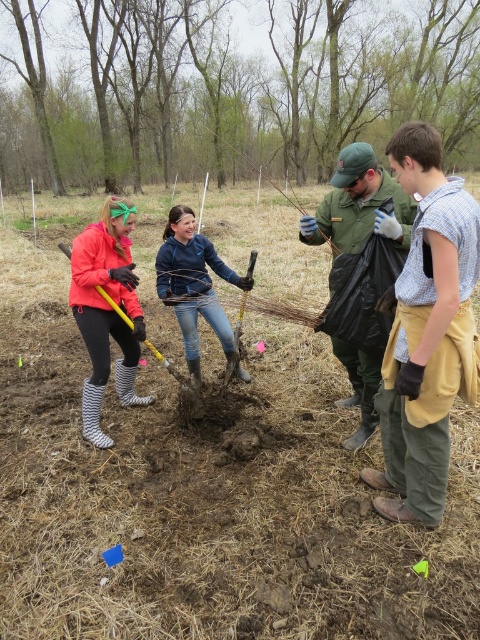
Who is more forward, (342,216) or (232,371)?

Positioned in front is point (342,216).

Does green matte jacket at center come in front of yellow metal shovel at center?

Yes, it is.

This screenshot has height=640, width=480. Identify the location of green matte jacket at center. (360, 205).

The image size is (480, 640). What are the coordinates of `blue denim jeans at center` in the screenshot? It's located at (193, 284).

This screenshot has height=640, width=480. I want to click on blue denim jeans at center, so click(x=193, y=284).

Identify the location of blue denim jeans at center. The image size is (480, 640). (193, 284).

What do you see at coordinates (231, 90) in the screenshot? I see `smooth bark tree at upper center` at bounding box center [231, 90].

From the picture: Can you confirm if smooth bark tree at upper center is positioned to the right of matte pink jacket at left?

Yes, smooth bark tree at upper center is to the right of matte pink jacket at left.

Find the location of a particular element. smooth bark tree at upper center is located at coordinates (231, 90).